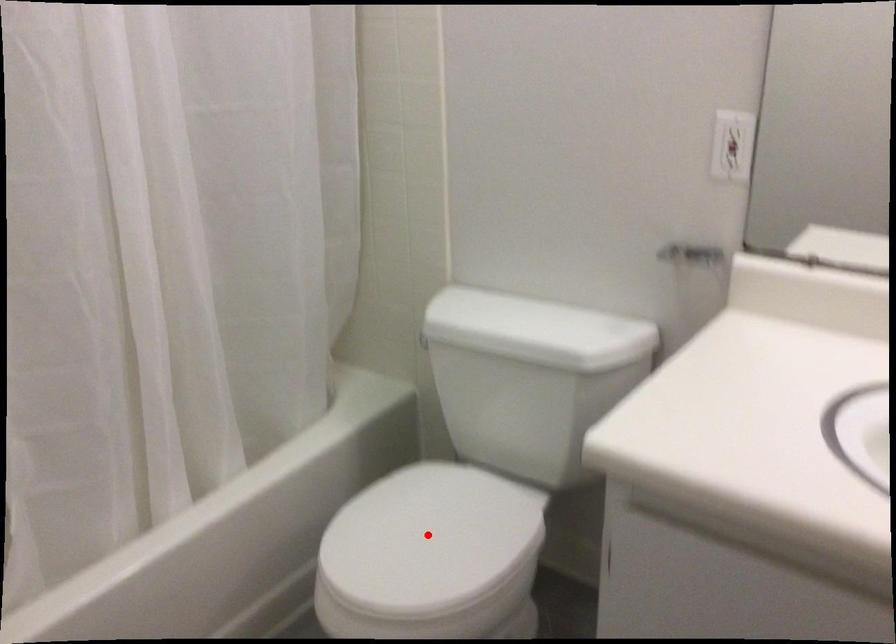
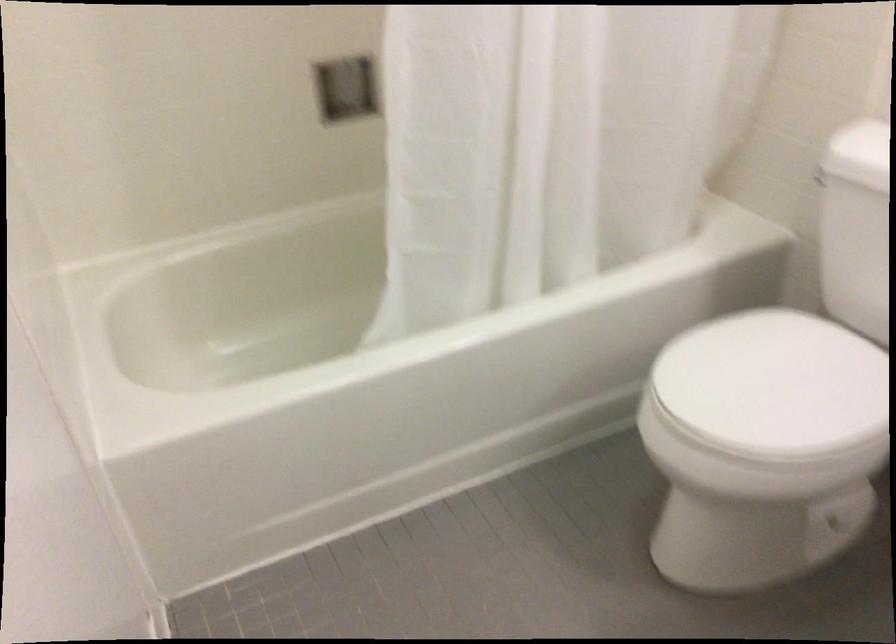
Question: I am providing you with two images of the same scene from different viewpoints. A red point is marked on the first image. At the location where the point appears in image 1, is it still visible in image 2?

Choices:
 (A) Yes
 (B) No

Answer: (A)